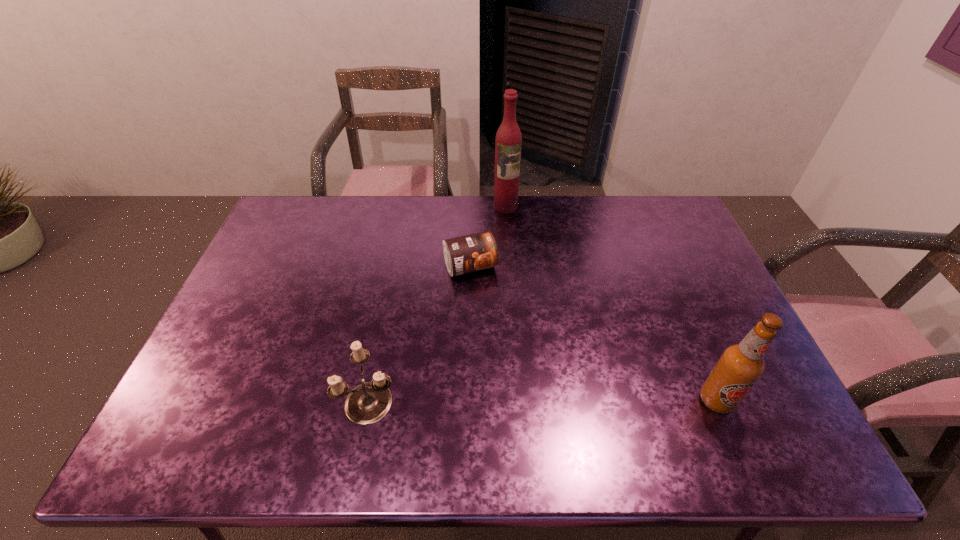
The width and height of the screenshot is (960, 540). What are the coordinates of `vacant space located on the label of the tallest object` in the screenshot? It's located at (520, 241).

Locate an element on the screen. Image resolution: width=960 pixels, height=540 pixels. vacant area situated 0.350m on the label of the tallest object is located at coordinates (536, 280).

The height and width of the screenshot is (540, 960). Identify the location of free region located on the front label of the third nearest object. 492,309.

The image size is (960, 540). In order to click on vacant space situated 0.200m on the front label of the third nearest object in this screenshot , I will do `click(502, 333)`.

Where is `vacant area situated 0.260m on the front label of the third nearest object`? The width and height of the screenshot is (960, 540). vacant area situated 0.260m on the front label of the third nearest object is located at coordinates (510, 349).

You are a GUI agent. You are given a task and a screenshot of the screen. Output one action in this format:
    pyautogui.click(x=<x>, y=<y>)
    Task: Click on the object that is at the far edge
    The width and height of the screenshot is (960, 540).
    Given the screenshot: What is the action you would take?
    pyautogui.click(x=508, y=142)

You are a GUI agent. You are given a task and a screenshot of the screen. Output one action in this format:
    pyautogui.click(x=<x>, y=<y>)
    Task: Click on the candle holder at the near edge
    Image resolution: width=960 pixels, height=540 pixels.
    Given the screenshot: What is the action you would take?
    pyautogui.click(x=369, y=402)

The height and width of the screenshot is (540, 960). I want to click on beer bottle that is at the near edge, so click(x=740, y=366).

The width and height of the screenshot is (960, 540). In order to click on object that is at the right edge in this screenshot , I will do `click(740, 366)`.

You are a GUI agent. You are given a task and a screenshot of the screen. Output one action in this format:
    pyautogui.click(x=<x>, y=<y>)
    Task: Click on the object present at the near right corner
    Image resolution: width=960 pixels, height=540 pixels.
    Given the screenshot: What is the action you would take?
    pyautogui.click(x=740, y=366)